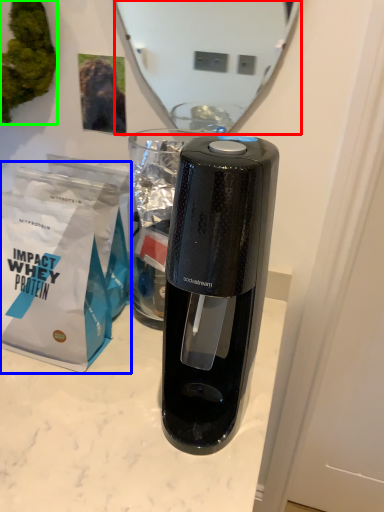
Question: Which is farther away from mirror (highlighted by a red box)? paper bag (highlighted by a blue box) or plant (highlighted by a green box)?

Choices:
 (A) paper bag
 (B) plant

Answer: (A)